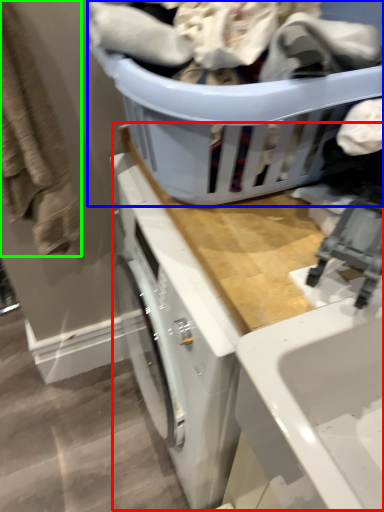
Question: Which object is the closest to the counter top (highlighted by a red box)? Choose among these: basket (highlighted by a blue box) or clothing (highlighted by a green box).

Choices:
 (A) basket
 (B) clothing

Answer: (A)